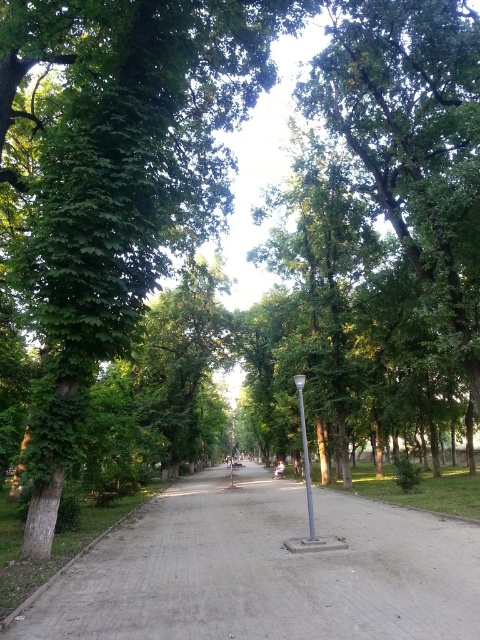
You are a pedestrian walking along the gray concrete pavement at center and the silver metallic pole at center. Which object is closer to you as you walk?

The gray concrete pavement at center is closer to the viewer than the silver metallic pole at center, so the gray concrete pavement at center would be closer to you as you walk.

Based on the photo, you are a maintenance worker who needs to place a new bench that requires a solid, flat surface. Looking at the image, which object between the gray concrete pavement at center and the silver metallic pole at center would be more suitable for placing the bench?

The gray concrete pavement at center is bigger than the silver metallic pole at center, so the gray concrete pavement at center would be more suitable for placing the bench as it provides a larger and flatter surface.